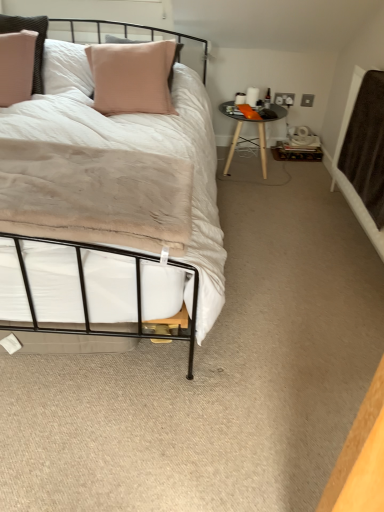
Question: Is point (365, 190) positioned closer to the camera than point (269, 119)?

Choices:
 (A) closer
 (B) farther

Answer: (A)

Question: Is brown textured blanket at right in front of or behind black glossy table at center right in the image?

Choices:
 (A) behind
 (B) front

Answer: (B)

Question: From a real-world perspective, is brown textured blanket at right physically located above or below black glossy table at center right?

Choices:
 (A) above
 (B) below

Answer: (A)

Question: Looking at the image, does black glossy table at center right seem bigger or smaller compared to brown textured blanket at right?

Choices:
 (A) small
 (B) big

Answer: (B)

Question: In terms of width, does black glossy table at center right look wider or thinner when compared to brown textured blanket at right?

Choices:
 (A) wide
 (B) thin

Answer: (A)

Question: Is black glossy table at center right in front of or behind brown textured blanket at right in the image?

Choices:
 (A) behind
 (B) front

Answer: (A)

Question: Which is correct: black glossy table at center right is inside brown textured blanket at right, or outside of it?

Choices:
 (A) outside
 (B) inside

Answer: (A)